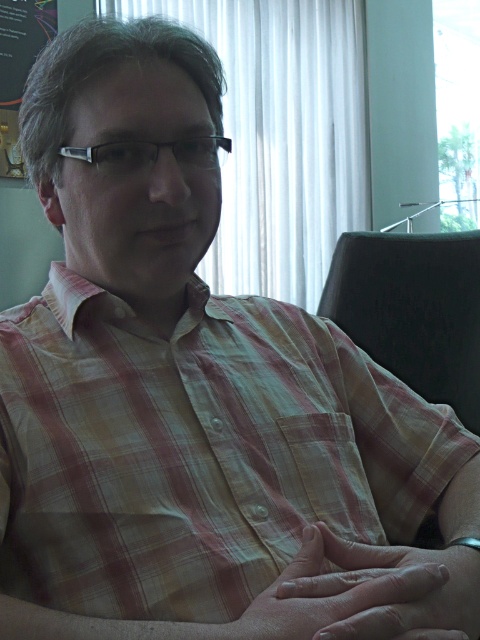
Does smooth skin hand at center come behind silver metallic glasses at center?

That is False.

Locate an element on the screen. This screenshot has height=640, width=480. smooth skin hand at center is located at coordinates (348, 595).

Between point (276, 580) and point (120, 163), which one is positioned in front?

Point (276, 580) is in front.

This screenshot has width=480, height=640. Identify the location of smooth skin hand at center. (348, 595).

Locate an element on the screen. This screenshot has width=480, height=640. black leather chair at right is located at coordinates (412, 308).

Locate an element on the screen. The height and width of the screenshot is (640, 480). black leather chair at right is located at coordinates (412, 308).

Does black leather chair at right have a larger size compared to silver metallic glasses at center?

Yes.

Can you confirm if black leather chair at right is thinner than silver metallic glasses at center?

No.

This screenshot has height=640, width=480. What do you see at coordinates (412, 308) in the screenshot?
I see `black leather chair at right` at bounding box center [412, 308].

Identify the location of black leather chair at right. (412, 308).